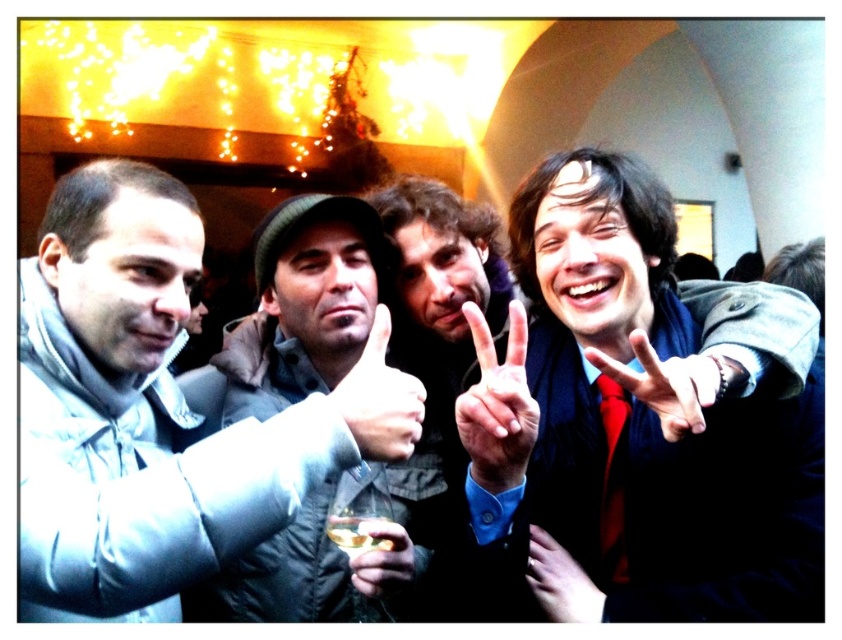
You are a photographer trying to capture a closeup shot of the translucent glass at center. However, the white matte hand at center is blocking the view. Can you estimate whether the hand is large enough to completely cover the glass in the frame?

The white matte hand at center has a larger size compared to the translucent glass at center, so the hand can completely cover the glass in the frame.

Based on the photo, you are a photographer trying to capture a group photo. You notice the gray matte jacket at upper left and the translucent glass at center. Based on their sizes, which object should you ensure stays within the frame to avoid cropping?

The gray matte jacket at upper left is wider than the translucent glass at center, so you should prioritize keeping the gray matte jacket at upper left within the frame to avoid cropping since it requires more space.

You are a photographer trying to capture a closeup shot of the translucent glass at center. The smooth skin hand at center is blocking your view. Can you estimate whether you need to move the hand closer or farther away from the glass to get a clear shot?

The smooth skin hand at center is larger in size than the translucent glass at center. To get a clear shot of the translucent glass at center, you need to move the hand farther away from the glass so it doesn not block the view.